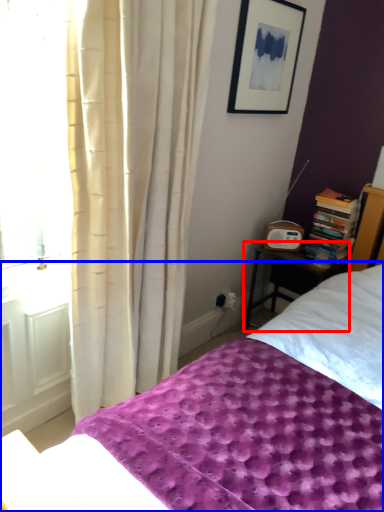
Question: Which object appears closest to the camera in this image, nightstand (highlighted by a red box) or bed (highlighted by a blue box)?

Choices:
 (A) nightstand
 (B) bed

Answer: (B)